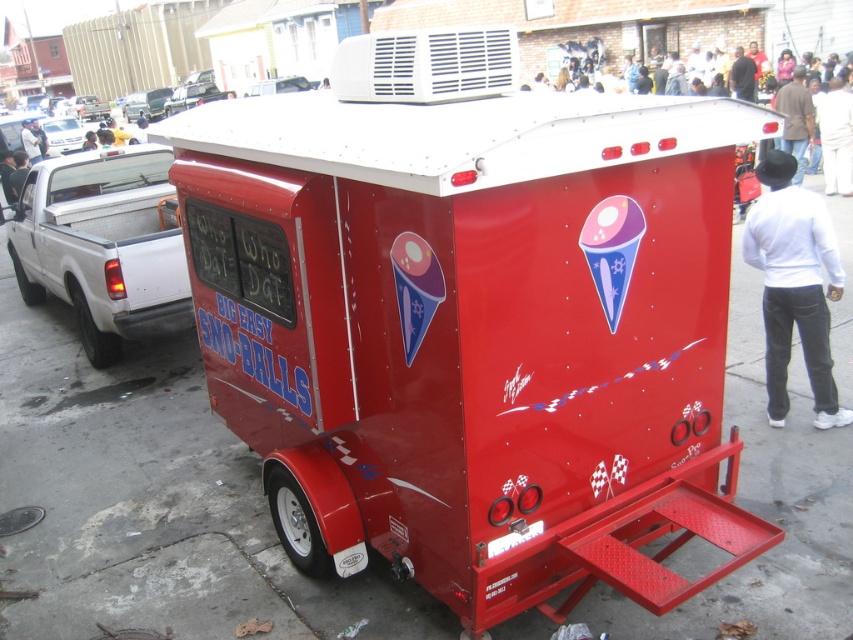
Question: Does shiny red trailer at center have a smaller size compared to brown leather jacket at upper right?

Choices:
 (A) yes
 (B) no

Answer: (B)

Question: Does brown leather jacket at upper right have a greater width compared to metallic silver car at left?

Choices:
 (A) yes
 (B) no

Answer: (B)

Question: Among these objects, which one is nearest to the camera?

Choices:
 (A) white shirt at upper center
 (B) metallic silver car at left
 (C) brown leather jacket at upper right

Answer: (C)

Question: Which is farther from the shiny red trailer at center?

Choices:
 (A) shiny silver car at upper left
 (B) white smooth shirt at right
 (C) white cotton shirt at right
 (D) white shirt at upper center

Answer: (A)

Question: Does white cotton shirt at right appear under metallic silver truck at upper left?

Choices:
 (A) yes
 (B) no

Answer: (A)

Question: Which object is positioned closest to the white cotton shirt at right?

Choices:
 (A) shiny silver car at upper left
 (B) shiny red trailer at center
 (C) brown leather jacket at upper right
 (D) metallic silver car at left

Answer: (C)